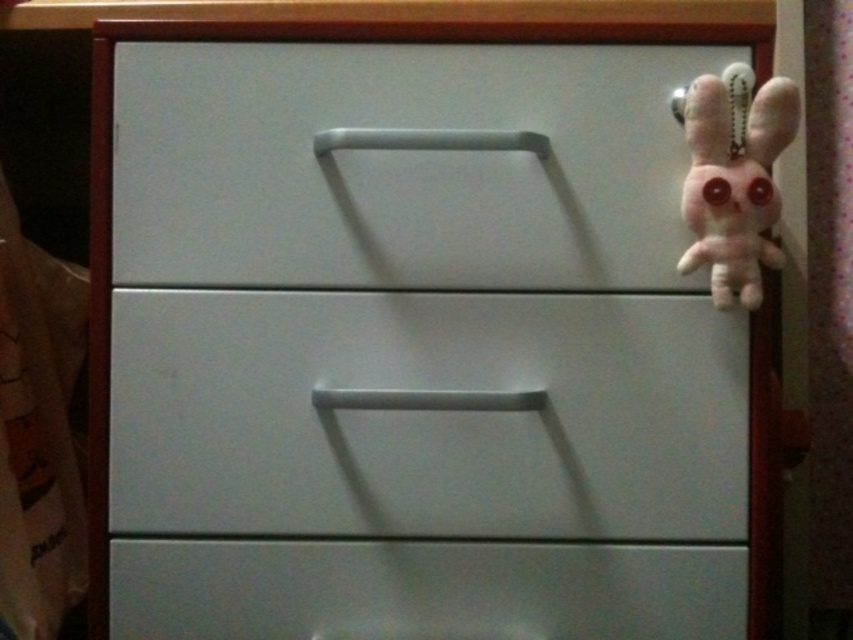
You are standing in front of a wooden furniture piece with three drawers. You need to place a small plush toy to the right side of the satin white drawer at lower center. According to the image, where should you position the toy relative to the drawer?

The satin white drawer at lower center is located at point (424, 589), so you should position the plush toy to the right of that coordinate.

You are trying to decide which drawer to use for storing small items. Based on their sizes, which drawer between the white matte drawer at center and the satin white drawer at lower center would you choose?

The white matte drawer at center might be wider than satin white drawer at lower center, so it could be better for storing small items that require more space.